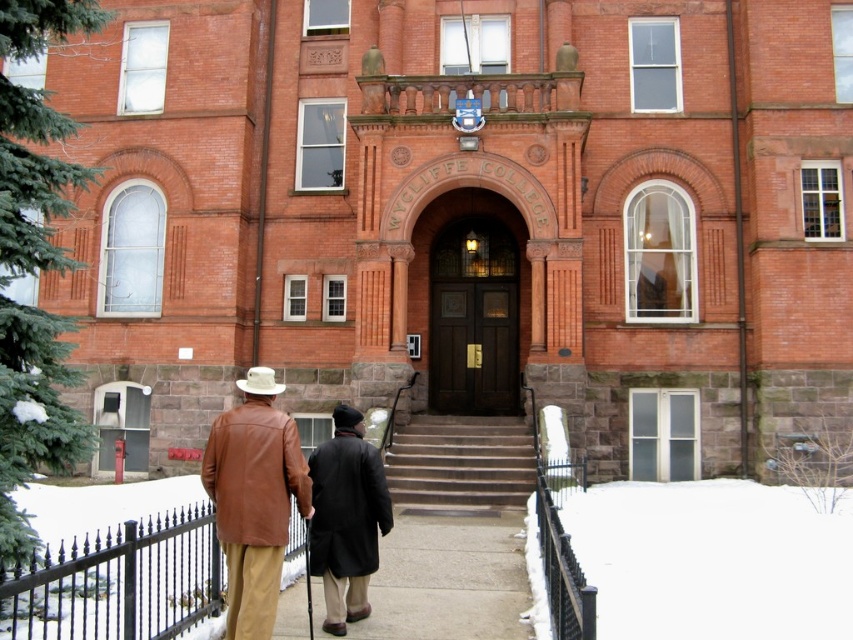
Which of these two, white powdery snow at lower center or dark brown leather coat at center, stands taller?

Standing taller between the two is white powdery snow at lower center.

Is white powdery snow at lower center wider than dark brown leather coat at center?

Indeed, white powdery snow at lower center has a greater width compared to dark brown leather coat at center.

Between point (621, 481) and point (320, 531), which one is positioned in front?

Point (320, 531)

The image size is (853, 640). I want to click on white powdery snow at lower center, so click(x=712, y=560).

Which is above, white powdery snow at lower center or smooth stone stairs at center?

smooth stone stairs at center is higher up.

Is white powdery snow at lower center wider than smooth stone stairs at center?

Correct, the width of white powdery snow at lower center exceeds that of smooth stone stairs at center.

Consider the image. Who is more distant from viewer, [608,497] or [410,428]?

Point [410,428]

Where is `white powdery snow at lower center`? white powdery snow at lower center is located at coordinates (712, 560).

Who is lower down, brown leather coat at center or dark brown leather coat at center?

dark brown leather coat at center

Can you confirm if brown leather coat at center is positioned to the left of dark brown leather coat at center?

Correct, you'll find brown leather coat at center to the left of dark brown leather coat at center.

Find the location of a particular element. brown leather coat at center is located at coordinates (254, 499).